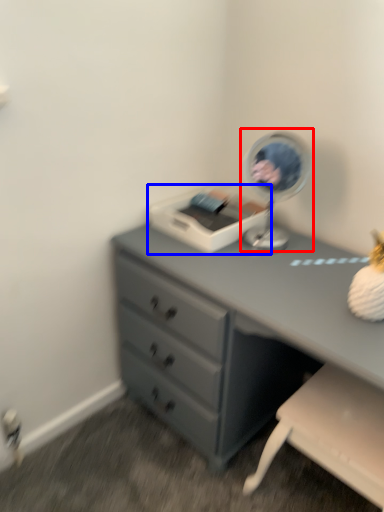
Question: Among these objects, which one is nearest to the camera, table lamp (highlighted by a red box) or printer (highlighted by a blue box)?

Choices:
 (A) table lamp
 (B) printer

Answer: (A)